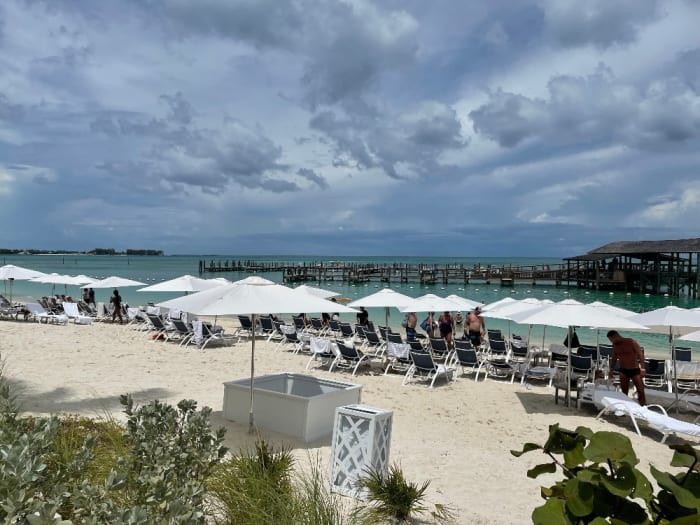
This screenshot has width=700, height=525. Identify the location of lounge chairs. (440, 370), (340, 357), (330, 349), (321, 346).